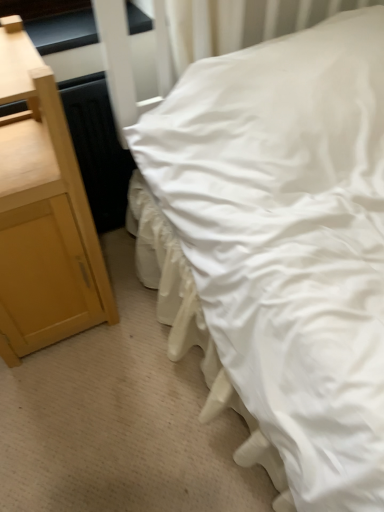
Find the location of a particular element. The height and width of the screenshot is (512, 384). vacant region to the right of light wood/texture nightstand at left is located at coordinates 138,332.